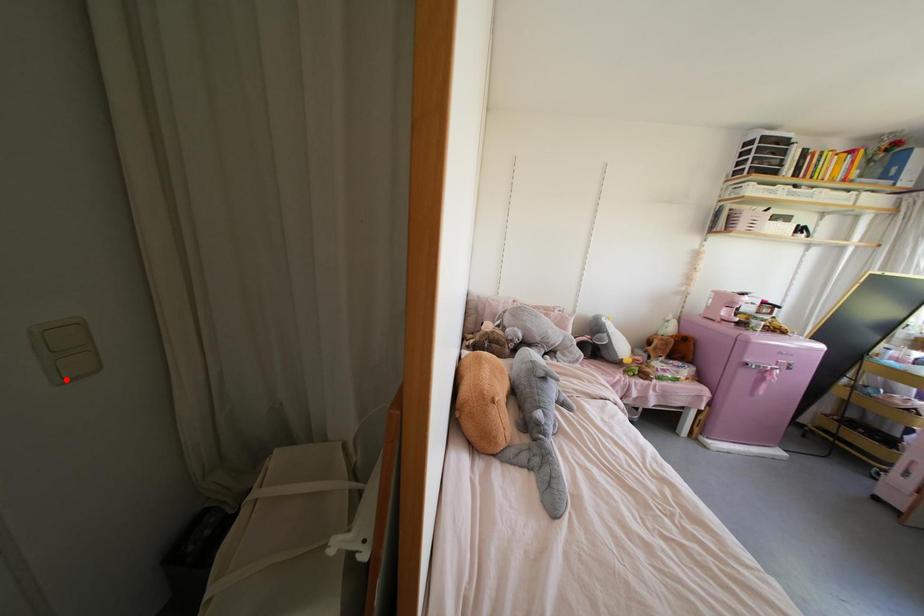
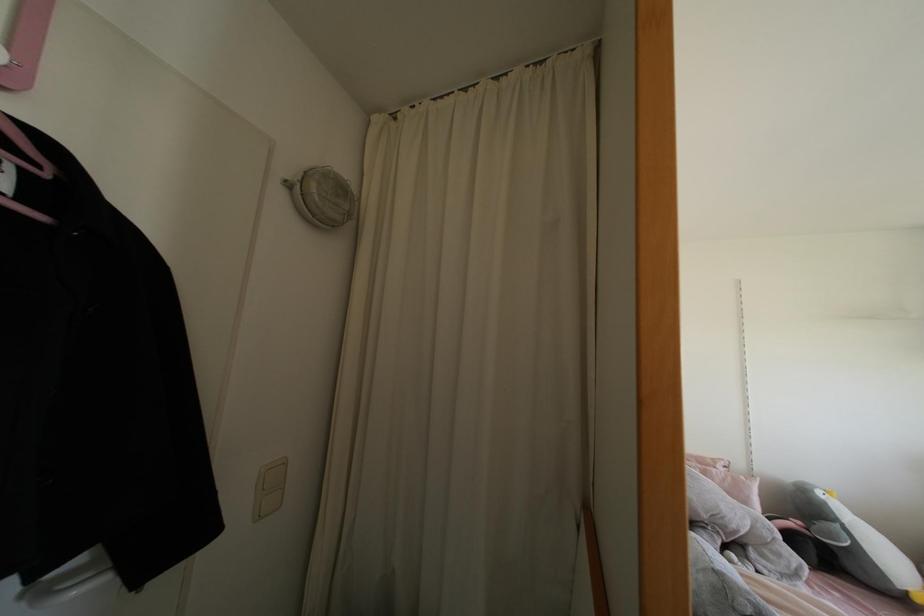
Question: A red point is marked in image1. In image2, is the corresponding 3D point closer to the camera or farther? Reply with the corresponding letter.

Choices:
 (A) The corresponding 3D point is closer.
 (B) The corresponding 3D point is farther.

Answer: (A)